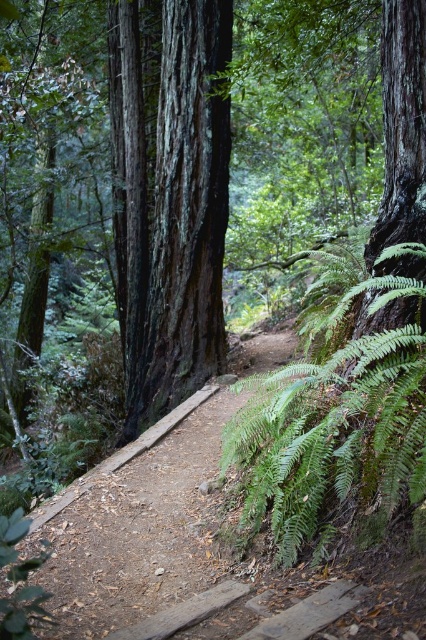
Question: Does dark brown textured bark at center come behind dirt path at center?

Choices:
 (A) yes
 (B) no

Answer: (A)

Question: Which is nearer to the green leafy fern at right?

Choices:
 (A) dark brown textured bark at center
 (B) dirt path at center

Answer: (B)

Question: Is green leafy fern at right wider than dirt path at center?

Choices:
 (A) no
 (B) yes

Answer: (A)

Question: Which point appears closest to the camera in this image?

Choices:
 (A) (247, 444)
 (B) (224, 406)

Answer: (A)

Question: Based on their relative distances, which object is farther from the dirt path at center?

Choices:
 (A) green leafy fern at right
 (B) dark brown textured bark at center

Answer: (B)

Question: Can you confirm if dark brown textured bark at center is smaller than green leafy fern at right?

Choices:
 (A) no
 (B) yes

Answer: (A)